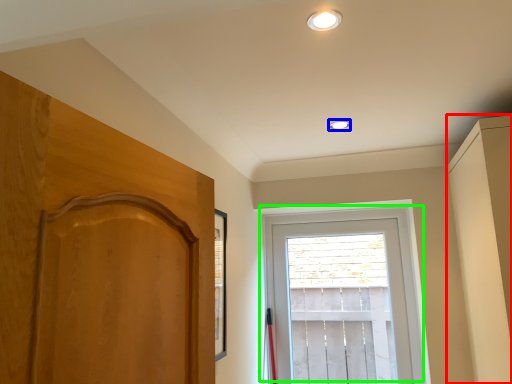
Question: Which is nearer to the dresser (highlighted by a red box)? lighting (highlighted by a blue box) or window (highlighted by a green box).

Choices:
 (A) lighting
 (B) window

Answer: (B)